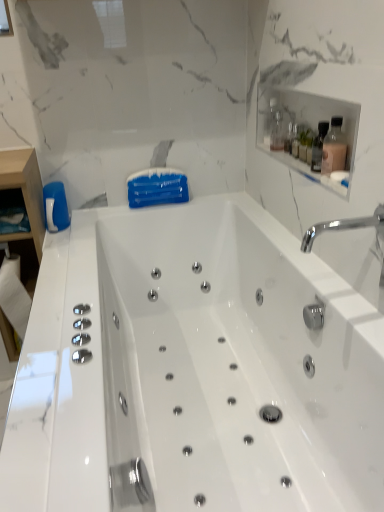
Locate an element on the screen. clear glass shelf at upper right is located at coordinates (306, 170).

This screenshot has height=512, width=384. What do you see at coordinates (344, 227) in the screenshot?
I see `chrome metallic faucet at upper right` at bounding box center [344, 227].

This screenshot has width=384, height=512. Find the location of `clear glass shelf at upper right`. clear glass shelf at upper right is located at coordinates 306,170.

What's the angular difference between chrome metallic faucet at upper right and white glossy bathtub at center's facing directions?

There is a 0.742-degree angle between the facing directions of chrome metallic faucet at upper right and white glossy bathtub at center.

Is chrome metallic faucet at upper right aimed at white glossy bathtub at center?

No, chrome metallic faucet at upper right is not turned towards white glossy bathtub at center.

Is chrome metallic faucet at upper right far from white glossy bathtub at center?

chrome metallic faucet at upper right is near white glossy bathtub at center, not far away.

Is matte pink glass bottle at upper right, which is counted as the first bottle, starting from the front, at the right side of clear glass bottle at upper right, positioned as the first bottle in top-to-bottom order?

Yes, matte pink glass bottle at upper right, which is counted as the first bottle, starting from the front, is to the right of clear glass bottle at upper right, positioned as the first bottle in top-to-bottom order.

Is matte pink glass bottle at upper right, the first bottle in the bottom-to-top sequence, next to clear glass bottle at upper right, positioned as the first bottle in top-to-bottom order?

There is a gap between matte pink glass bottle at upper right, the first bottle in the bottom-to-top sequence, and clear glass bottle at upper right, positioned as the first bottle in top-to-bottom order.

Is clear glass bottle at upper right, acting as the second bottle starting from the front, to the right of matte pink glass bottle at upper right, positioned as the second bottle in left-to-right order, from the viewer's perspective?

Incorrect, clear glass bottle at upper right, acting as the second bottle starting from the front, is not on the right side of matte pink glass bottle at upper right, positioned as the second bottle in left-to-right order.

Considering the relative positions of clear glass bottle at upper right, acting as the second bottle starting from the front, and matte pink glass bottle at upper right, which is counted as the first bottle, starting from the right, in the image provided, is clear glass bottle at upper right, acting as the second bottle starting from the front, in front of matte pink glass bottle at upper right, which is counted as the first bottle, starting from the right,?

Result: No, it is behind matte pink glass bottle at upper right, which is counted as the first bottle, starting from the right.

Between clear glass bottle at upper right, acting as the second bottle starting from the front, and matte pink glass bottle at upper right, arranged as the second bottle when viewed from the back, which one has more height?

matte pink glass bottle at upper right, arranged as the second bottle when viewed from the back, is taller.

Are clear glass shelf at upper right and clear glass bottle at upper right, acting as the second bottle starting from the front, located far from each other?

That's not correct — clear glass shelf at upper right is a little close to clear glass bottle at upper right, acting as the second bottle starting from the front.

Which is in front, point (269, 152) or point (274, 144)?

The point (269, 152) is closer to the camera.

From a real-world perspective, is clear glass shelf at upper right below clear glass bottle at upper right, positioned as the first bottle in top-to-bottom order?

Yes, from a real-world perspective, clear glass shelf at upper right is below clear glass bottle at upper right, positioned as the first bottle in top-to-bottom order.

Is clear glass shelf at upper right positioned with its back to clear glass bottle at upper right, acting as the second bottle starting from the front?

No, clear glass bottle at upper right, acting as the second bottle starting from the front, is not at the back of clear glass shelf at upper right.

Choose the correct answer: Is chrome metallic faucet at upper right inside clear glass shelf at upper right or outside it?

chrome metallic faucet at upper right lies outside clear glass shelf at upper right.

In the scene shown: Is chrome metallic faucet at upper right facing away from clear glass shelf at upper right?

No, chrome metallic faucet at upper right is not facing the opposite direction of clear glass shelf at upper right.

Is chrome metallic faucet at upper right positioned before clear glass shelf at upper right?

Yes, chrome metallic faucet at upper right is closer to the viewer.

From the image's perspective, which is below, chrome metallic faucet at upper right or clear glass shelf at upper right?

chrome metallic faucet at upper right, from the image's perspective.

Considering the relative sizes of matte pink glass bottle at upper right, positioned as the second bottle in left-to-right order, and chrome metallic faucet at upper right in the image provided, is matte pink glass bottle at upper right, positioned as the second bottle in left-to-right order, smaller than chrome metallic faucet at upper right?

Yes.

From a real-world perspective, which is physically below, matte pink glass bottle at upper right, which is counted as the first bottle, starting from the right, or chrome metallic faucet at upper right?

chrome metallic faucet at upper right.

Which of these two, matte pink glass bottle at upper right, which is counted as the first bottle, starting from the right, or chrome metallic faucet at upper right, stands shorter?

chrome metallic faucet at upper right.

From the image's perspective, between matte pink glass bottle at upper right, arranged as the second bottle when viewed from the back, and chrome metallic faucet at upper right, which one is located above?

matte pink glass bottle at upper right, arranged as the second bottle when viewed from the back.

Who is more distant, chrome metallic faucet at upper right or matte pink glass bottle at upper right, positioned as the second bottle in left-to-right order?

matte pink glass bottle at upper right, positioned as the second bottle in left-to-right order, is further from the camera.

Is chrome metallic faucet at upper right beside matte pink glass bottle at upper right, which is the 2th bottle from top to bottom?

No, chrome metallic faucet at upper right is not with matte pink glass bottle at upper right, which is the 2th bottle from top to bottom.

Considering the relative sizes of chrome metallic faucet at upper right and matte pink glass bottle at upper right, positioned as the second bottle in left-to-right order, in the image provided, is chrome metallic faucet at upper right shorter than matte pink glass bottle at upper right, positioned as the second bottle in left-to-right order,?

Yes, chrome metallic faucet at upper right is shorter than matte pink glass bottle at upper right, positioned as the second bottle in left-to-right order.

Considering the relative sizes of chrome metallic faucet at upper right and matte pink glass bottle at upper right, arranged as the second bottle when viewed from the back, in the image provided, is chrome metallic faucet at upper right smaller than matte pink glass bottle at upper right, arranged as the second bottle when viewed from the back,?

→ No, chrome metallic faucet at upper right is not smaller than matte pink glass bottle at upper right, arranged as the second bottle when viewed from the back.

The image size is (384, 512). Identify the location of bathtub below the chrome metallic faucet at upper right (from a real-world perspective). (194, 368).

The height and width of the screenshot is (512, 384). I want to click on bottle lying behind the matte pink glass bottle at upper right, arranged as the second bottle when viewed from the back, so click(277, 131).

Based on their spatial positions, is clear glass shelf at upper right or white glossy bathtub at center further from matte pink glass bottle at upper right, positioned as the second bottle in left-to-right order?

white glossy bathtub at center.

Based on the photo, which object lies nearer to the anchor point matte pink glass bottle at upper right, the first bottle in the bottom-to-top sequence, white glossy bathtub at center or clear glass shelf at upper right?

clear glass shelf at upper right is closer to matte pink glass bottle at upper right, the first bottle in the bottom-to-top sequence.

Based on their spatial positions, is white glossy bathtub at center or clear glass shelf at upper right further from clear glass bottle at upper right, acting as the second bottle starting from the front?

white glossy bathtub at center is positioned further to the anchor clear glass bottle at upper right, acting as the second bottle starting from the front.

Looking at the image, which one is located further to chrome metallic faucet at upper right, matte pink glass bottle at upper right, which is the 2th bottle from top to bottom, or white glossy bathtub at center?

Based on the image, white glossy bathtub at center appears to be further to chrome metallic faucet at upper right.

Looking at the image, which one is located further to matte pink glass bottle at upper right, positioned as the second bottle in left-to-right order, white glossy bathtub at center or clear glass bottle at upper right, positioned as the first bottle in top-to-bottom order?

The object further to matte pink glass bottle at upper right, positioned as the second bottle in left-to-right order, is white glossy bathtub at center.

From the image, which object appears to be farther from chrome metallic faucet at upper right, matte pink glass bottle at upper right, the first bottle in the bottom-to-top sequence, or clear glass shelf at upper right?

Based on the image, matte pink glass bottle at upper right, the first bottle in the bottom-to-top sequence, appears to be further to chrome metallic faucet at upper right.

Looking at the image, which one is located closer to clear glass shelf at upper right, chrome metallic faucet at upper right or clear glass bottle at upper right, positioned as the first bottle in left-to-right order?

chrome metallic faucet at upper right is positioned closer to the anchor clear glass shelf at upper right.

Estimate the real-world distances between objects in this image. Which object is closer to matte pink glass bottle at upper right, the first bottle in the bottom-to-top sequence, clear glass bottle at upper right, the 2th bottle ordered from the bottom, or clear glass shelf at upper right?

clear glass shelf at upper right lies closer to matte pink glass bottle at upper right, the first bottle in the bottom-to-top sequence, than the other object.

You are a GUI agent. You are given a task and a screenshot of the screen. Output one action in this format:
    pyautogui.click(x=<x>, y=<y>)
    Task: Click on the bottle positioned between clear glass shelf at upper right and clear glass bottle at upper right, acting as the 1th bottle starting from the back, from near to far
    This screenshot has height=512, width=384.
    Given the screenshot: What is the action you would take?
    pyautogui.click(x=334, y=148)

Where is `tap positioned between white glossy bathtub at center and clear glass bottle at upper right, acting as the second bottle starting from the front, from near to far`? The height and width of the screenshot is (512, 384). tap positioned between white glossy bathtub at center and clear glass bottle at upper right, acting as the second bottle starting from the front, from near to far is located at coordinates (344, 227).

The width and height of the screenshot is (384, 512). What are the coordinates of `balustrade between matte pink glass bottle at upper right, positioned as the second bottle in left-to-right order, and white glossy bathtub at center from top to bottom` in the screenshot? It's located at (306, 170).

Identify the location of balustrade between chrome metallic faucet at upper right and clear glass bottle at upper right, positioned as the first bottle in left-to-right order, in the front-back direction. (306, 170).